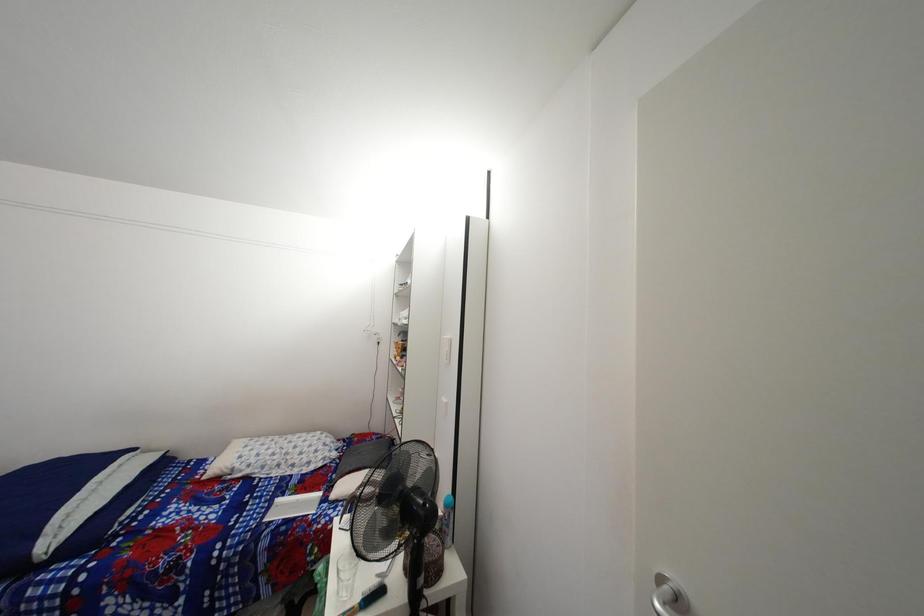
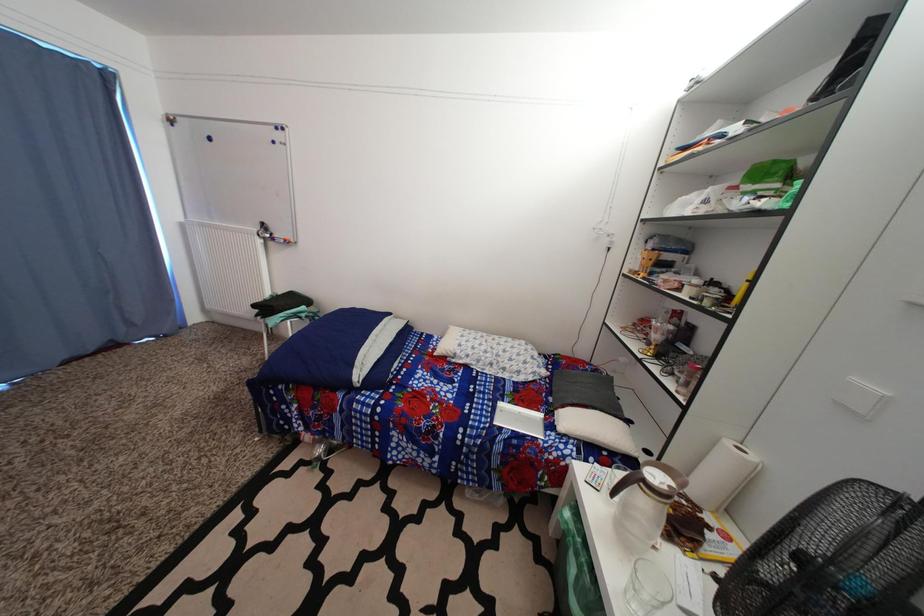
First-person continuous shooting, in which direction is the camera rotating?

The camera's rotation is toward left-down.